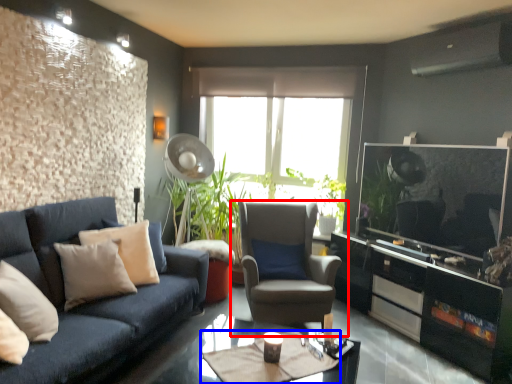
Question: Which object is further to the camera taking this photo, chair (highlighted by a red box) or cocktail table (highlighted by a blue box)?

Choices:
 (A) chair
 (B) cocktail table

Answer: (A)